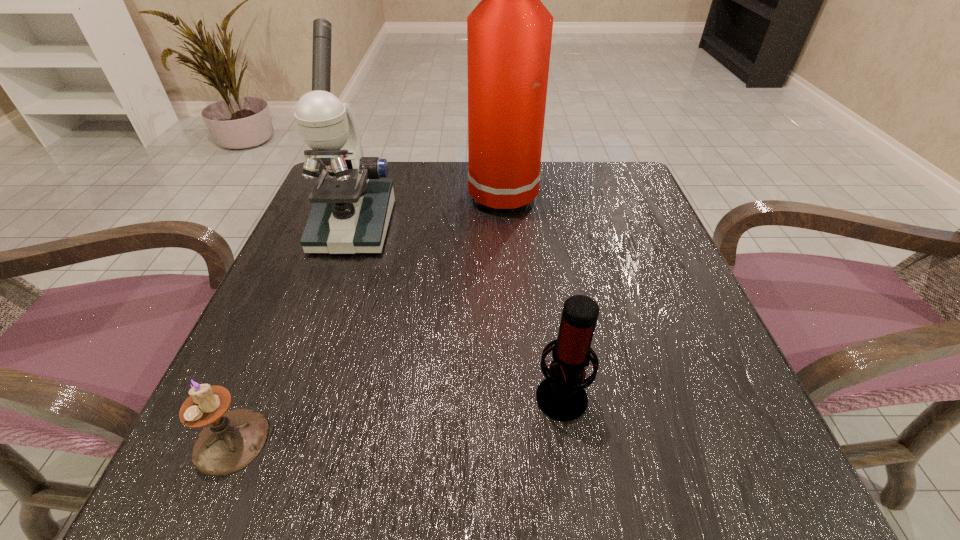
The width and height of the screenshot is (960, 540). In the image, there is a desktop. What are the coordinates of `vacant space at the right edge` in the screenshot? It's located at (668, 269).

Identify the location of vacant space at the near left corner of the desktop. The width and height of the screenshot is (960, 540). (280, 458).

This screenshot has width=960, height=540. I want to click on vacant space at the far right corner of the desktop, so click(616, 181).

This screenshot has height=540, width=960. Identify the location of vacant space at the near right corner of the desktop. (714, 464).

Image resolution: width=960 pixels, height=540 pixels. Find the location of `vacant space that's between the shortest object and the microphone`. vacant space that's between the shortest object and the microphone is located at coordinates (396, 417).

Locate an element on the screen. vacant space that's between the tallest object and the shortest object is located at coordinates (374, 319).

Where is `vacant area between the third tallest object and the fire extinguisher`? vacant area between the third tallest object and the fire extinguisher is located at coordinates (540, 295).

I want to click on free area in between the tallest object and the second tallest object, so click(x=435, y=211).

Find the location of a particular element. empty location between the third tallest object and the candle holder is located at coordinates (396, 417).

Find the location of a particular element. vacant space that's between the microscope and the fire extinguisher is located at coordinates (435, 211).